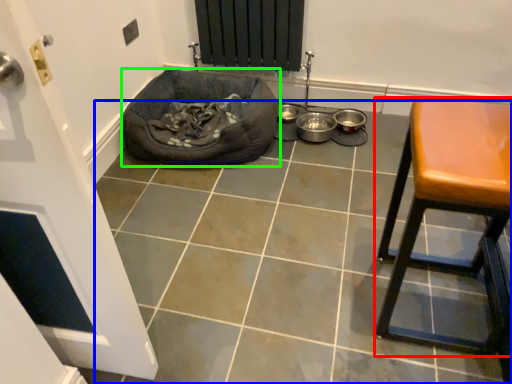
Question: Considering the real-world distances, which object is farthest from furniture (highlighted by a red box)? tile (highlighted by a blue box) or dog bed (highlighted by a green box)?

Choices:
 (A) tile
 (B) dog bed

Answer: (B)